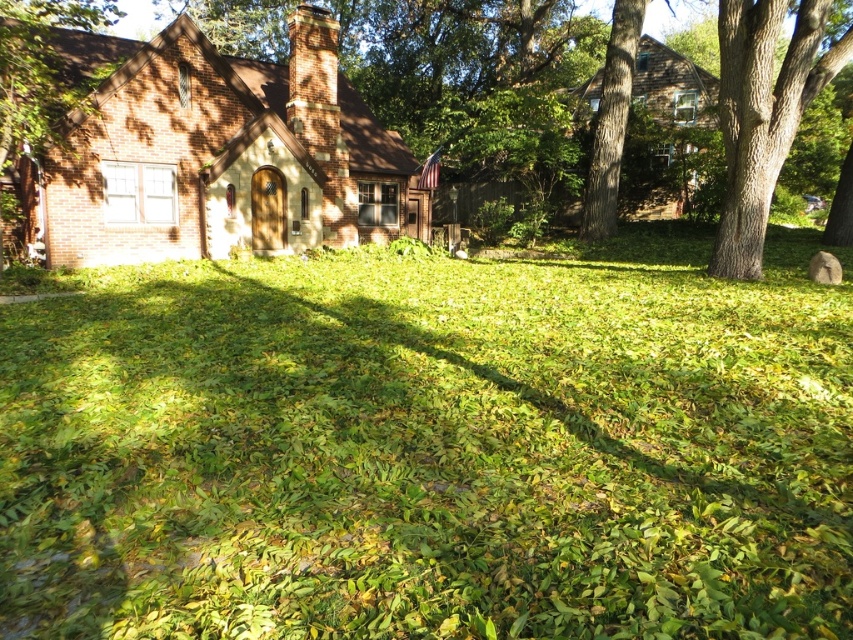
Is green leafy grass at center taller than brick wall at left?

In fact, green leafy grass at center may be shorter than brick wall at left.

Is point (828, 308) positioned behind point (16, 83)?

No, it is not.

Locate an element on the screen. Image resolution: width=853 pixels, height=640 pixels. green leafy grass at center is located at coordinates (431, 449).

The image size is (853, 640). Describe the element at coordinates (431, 449) in the screenshot. I see `green leafy grass at center` at that location.

Where is `green leafy grass at center`? green leafy grass at center is located at coordinates (431, 449).

Find the location of a particular element. green leafy grass at center is located at coordinates (431, 449).

Is point (732, 84) positioned in front of point (15, 38)?

No, it is behind (15, 38).

Describe the element at coordinates (763, 115) in the screenshot. This screenshot has width=853, height=640. I see `green rough bark tree at right` at that location.

This screenshot has width=853, height=640. What do you see at coordinates (763, 115) in the screenshot? I see `green rough bark tree at right` at bounding box center [763, 115].

Locate an element on the screen. This screenshot has height=640, width=853. green rough bark tree at right is located at coordinates (763, 115).